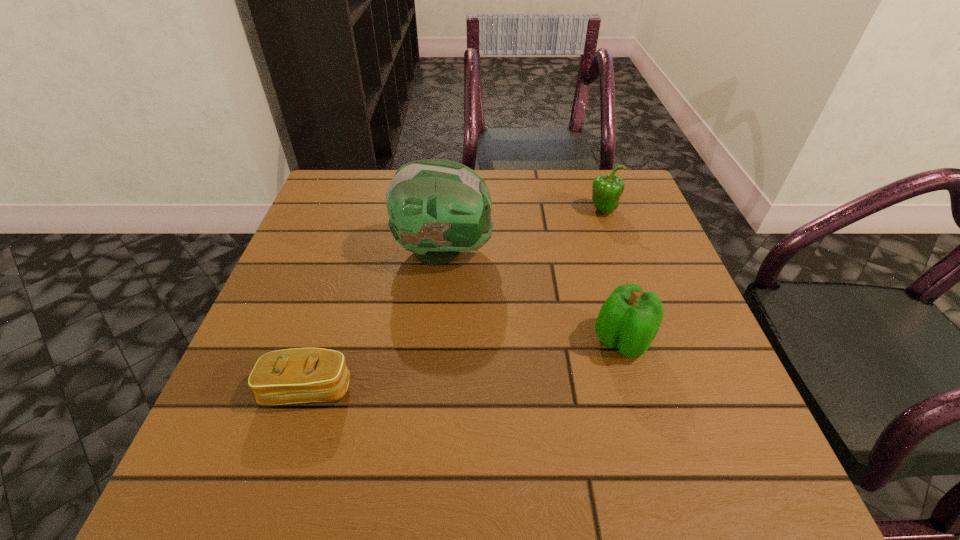
The height and width of the screenshot is (540, 960). Find the location of `football helmet`. football helmet is located at coordinates point(437,208).

Locate an element on the screen. The width and height of the screenshot is (960, 540). the third object from right to left is located at coordinates (437, 208).

I want to click on the farthest object, so click(606, 189).

Locate an element on the screen. The width and height of the screenshot is (960, 540). the nearer bell pepper is located at coordinates (629, 319).

You are a GUI agent. You are given a task and a screenshot of the screen. Output one action in this format:
    pyautogui.click(x=<x>, y=<y>)
    Task: Click on the shortest object
    The width and height of the screenshot is (960, 540).
    Given the screenshot: What is the action you would take?
    pyautogui.click(x=299, y=375)

This screenshot has width=960, height=540. I want to click on the nearest object, so click(x=299, y=375).

Find the location of a particular element. This screenshot has width=960, height=540. vacant position located 0.220m on the visor of the football helmet is located at coordinates (590, 251).

Image resolution: width=960 pixels, height=540 pixels. I want to click on free space located 0.070m on the left of the farther bell pepper, so click(x=561, y=210).

Where is `vacant region located on the left of the nearer bell pepper`? vacant region located on the left of the nearer bell pepper is located at coordinates tap(463, 340).

This screenshot has height=540, width=960. What are the coordinates of `vacant area located on the zipper side of the clutch bag` in the screenshot? It's located at (289, 448).